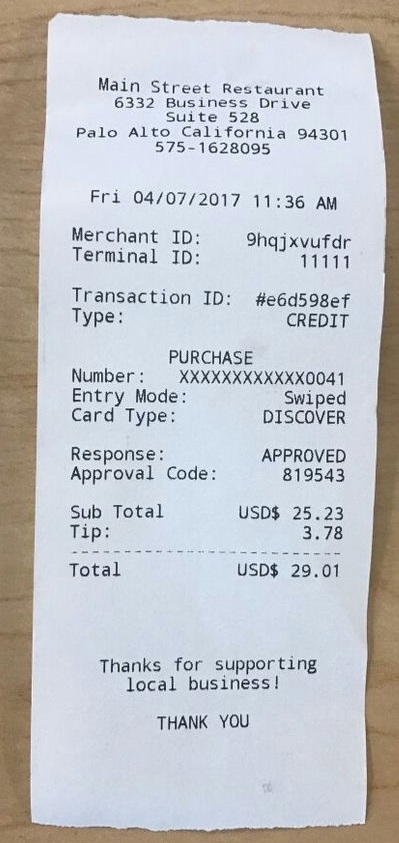
At what (x,y) coordinates should I click in order to perform the action: click on light brown wood table. Please return your answer as a coordinate pair (x, y). The width and height of the screenshot is (399, 843). Looking at the image, I should click on (200, 7).